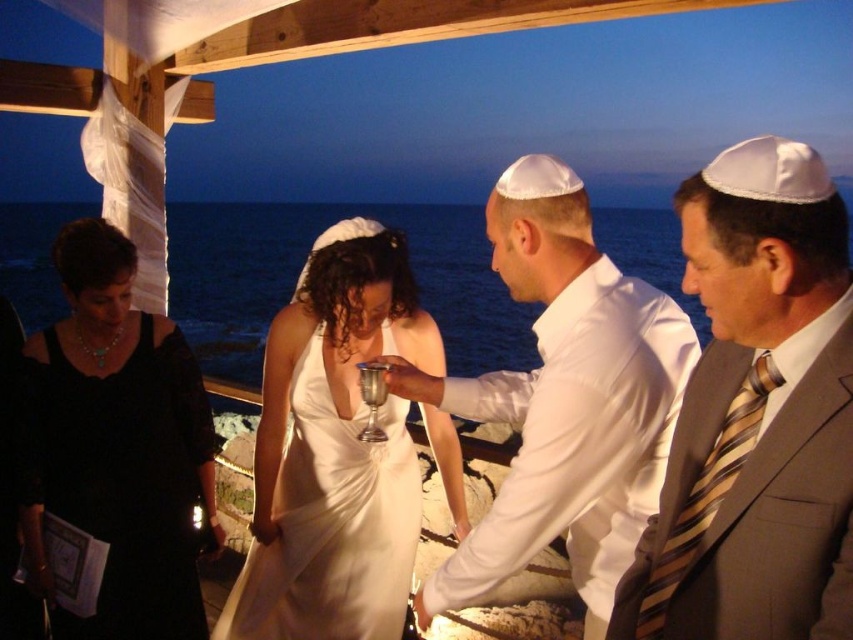
Who is shorter, striped silk tie at right or black satin dress at lower left?

With less height is striped silk tie at right.

Does point (811, 544) lie in front of point (195, 456)?

Yes, point (811, 544) is closer to viewer.

I want to click on striped silk tie at right, so click(x=756, y=413).

Describe the element at coordinates (564, 400) in the screenshot. The height and width of the screenshot is (640, 853). I see `white satin kippah at upper center` at that location.

The width and height of the screenshot is (853, 640). Find the location of `white satin kippah at upper center`. white satin kippah at upper center is located at coordinates (564, 400).

Find the location of a particular element. white satin kippah at upper center is located at coordinates (564, 400).

Is black satin dress at lower left in front of white satin dress at center?

Yes, it is in front of white satin dress at center.

Does black satin dress at lower left have a lesser height compared to white satin dress at center?

No, black satin dress at lower left is not shorter than white satin dress at center.

Where is `black satin dress at lower left`? black satin dress at lower left is located at coordinates (120, 440).

In order to click on black satin dress at lower left in this screenshot , I will do `click(120, 440)`.